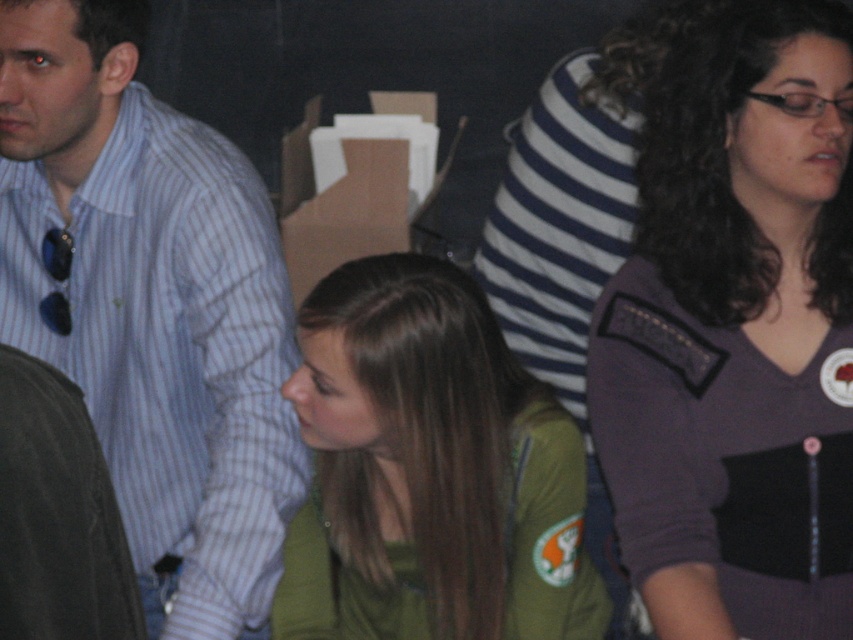
Question: Can you confirm if purple fabric shirt at center is positioned to the left of cardboard box at center?

Choices:
 (A) no
 (B) yes

Answer: (A)

Question: Which point is farther to the camera?

Choices:
 (A) (706, 205)
 (B) (515, 524)
 (C) (62, 310)
 (D) (433, 160)

Answer: (D)

Question: Is purple fabric shirt at center to the right of blue striped shirt at left from the viewer's perspective?

Choices:
 (A) no
 (B) yes

Answer: (B)

Question: Which of the following is the closest to the observer?

Choices:
 (A) cardboard box at center
 (B) purple fabric shirt at center
 (C) blue striped shirt at left
 (D) green matte jacket at center

Answer: (D)

Question: Is purple fabric shirt at center thinner than cardboard box at center?

Choices:
 (A) yes
 (B) no

Answer: (A)

Question: Which object appears farthest from the camera in this image?

Choices:
 (A) cardboard box at center
 (B) purple fabric shirt at center
 (C) blue striped shirt at left
 (D) green matte jacket at center

Answer: (A)